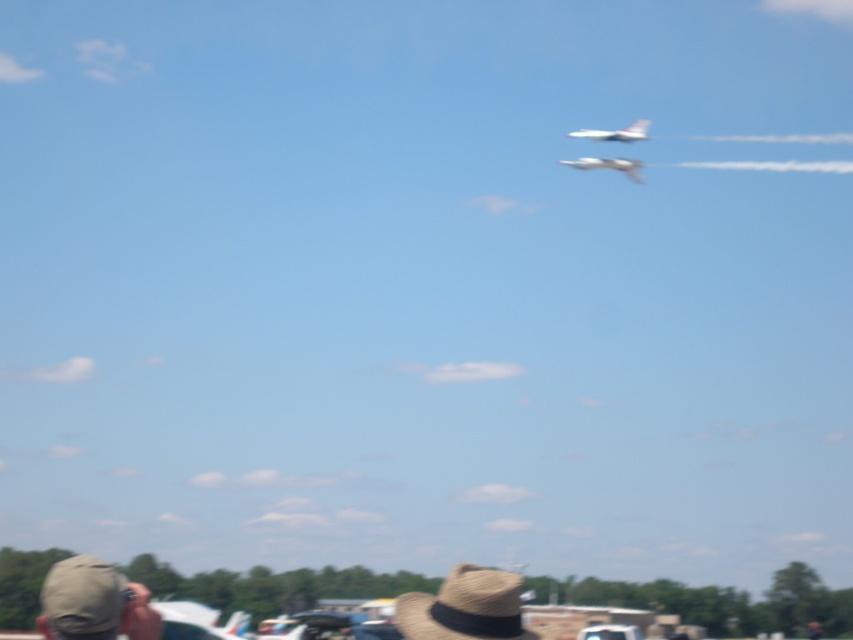
Question: Which object is positioned closest to the straw textured cowboy hat at center?

Choices:
 (A) khaki fabric cap at lower left
 (B) white matte airplane at upper center

Answer: (A)

Question: Is khaki fabric cap at lower left in front of straw textured cowboy hat at center?

Choices:
 (A) no
 (B) yes

Answer: (B)

Question: Which object is the closest to the khaki fabric cap at lower left?

Choices:
 (A) straw textured cowboy hat at center
 (B) white matte airplane at upper center
 (C) white glossy airplane at upper center

Answer: (A)

Question: Is straw textured cowboy hat at center positioned behind white matte airplane at upper center?

Choices:
 (A) no
 (B) yes

Answer: (A)

Question: Is white matte airplane at upper center to the right of white glossy airplane at upper center from the viewer's perspective?

Choices:
 (A) no
 (B) yes

Answer: (B)

Question: Which object appears farthest from the camera in this image?

Choices:
 (A) white matte airplane at upper center
 (B) straw textured cowboy hat at center
 (C) white glossy airplane at upper center

Answer: (A)